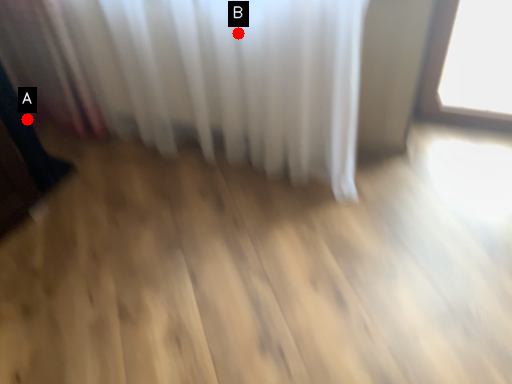
Question: Two points are circled on the image, labeled by A and B beside each circle. Which of the following is the closest to the observer?

Choices:
 (A) A is closer
 (B) B is closer

Answer: (B)